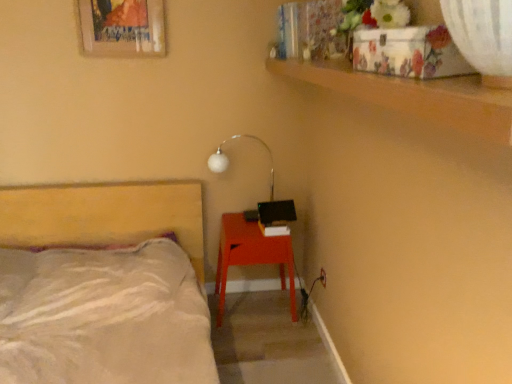
What is the approximate height of wooden picture frame at upper left?

wooden picture frame at upper left is 11.02 inches in height.

Describe the element at coordinates (104, 286) in the screenshot. Image resolution: width=512 pixels, height=384 pixels. I see `beige fabric bed at left` at that location.

Locate an element on the screen. This screenshot has height=384, width=512. wooden picture frame at upper left is located at coordinates (122, 28).

Can you confirm if beige fabric bed at left is positioned to the right of white glossy lamp at upper center?

No, beige fabric bed at left is not to the right of white glossy lamp at upper center.

Based on the photo, which object is wider, beige fabric bed at left or white glossy lamp at upper center?

beige fabric bed at left.

Is beige fabric bed at left shorter than white glossy lamp at upper center?

No, beige fabric bed at left is not shorter than white glossy lamp at upper center.

Is beige fabric bed at left turned away from white glossy lamp at upper center?

No, beige fabric bed at left is not facing the opposite direction of white glossy lamp at upper center.

From the image's perspective, which is below, wooden picture frame at upper left or white glossy lamp at upper center?

white glossy lamp at upper center, from the image's perspective.

Is wooden picture frame at upper left far from white glossy lamp at upper center?

That's not correct — wooden picture frame at upper left is a little close to white glossy lamp at upper center.

Looking at this image, is wooden picture frame at upper left looking in the opposite direction of white glossy lamp at upper center?

No, white glossy lamp at upper center is not at the back of wooden picture frame at upper left.

Is point (104, 13) closer or farther from the camera than point (219, 155)?

Point (104, 13) is positioned closer to the camera compared to point (219, 155).

Is matte red nightstand at lower right smaller than white glossy lamp at upper center?

Actually, matte red nightstand at lower right might be larger than white glossy lamp at upper center.

Can you tell me how much matte red nightstand at lower right and white glossy lamp at upper center differ in facing direction?

The angle between the facing direction of matte red nightstand at lower right and the facing direction of white glossy lamp at upper center is 0.414 degrees.

Is matte red nightstand at lower right outside of white glossy lamp at upper center?

matte red nightstand at lower right is positioned outside white glossy lamp at upper center.

From the image's perspective, which is above, matte red nightstand at lower right or white glossy lamp at upper center?

white glossy lamp at upper center.

Is point (221, 146) closer to viewer compared to point (117, 56)?

No, it is not.

From the image's perspective, which object appears higher, white glossy lamp at upper center or wooden picture frame at upper left?

wooden picture frame at upper left is shown above in the image.

Could you tell me if white glossy lamp at upper center is facing wooden picture frame at upper left?

No.

Which is in front, point (158, 27) or point (146, 218)?

The point (158, 27) is in front.

Does wooden picture frame at upper left touch beige fabric bed at left?

No, wooden picture frame at upper left is not beside beige fabric bed at left.

Is wooden picture frame at upper left positioned with its back to beige fabric bed at left?

No, wooden picture frame at upper left is not facing away from beige fabric bed at left.

Is beige fabric bed at left located within wooden picture frame at upper left?

No, beige fabric bed at left is not a part of wooden picture frame at upper left.

Can we say white glossy lamp at upper center lies outside beige fabric bed at left?

Yes, white glossy lamp at upper center is outside of beige fabric bed at left.

Can you tell me how much white glossy lamp at upper center and beige fabric bed at left differ in facing direction?

The angle between the facing direction of white glossy lamp at upper center and the facing direction of beige fabric bed at left is 0.915 degrees.

Based on the photo, from the image's perspective, is white glossy lamp at upper center located above or below beige fabric bed at left?

Based on their image positions, white glossy lamp at upper center is located above beige fabric bed at left.

Looking at this image, considering the sizes of white glossy lamp at upper center and beige fabric bed at left in the image, is white glossy lamp at upper center bigger or smaller than beige fabric bed at left?

white glossy lamp at upper center is smaller than beige fabric bed at left.

Is wooden picture frame at upper left aimed at matte red nightstand at lower right?

No, wooden picture frame at upper left is not facing towards matte red nightstand at lower right.

From the image's perspective, which one is positioned lower, wooden picture frame at upper left or matte red nightstand at lower right?

matte red nightstand at lower right is shown below in the image.

Consider the image. Is wooden picture frame at upper left in front of or behind matte red nightstand at lower right in the image?

Visually, wooden picture frame at upper left is located in front of matte red nightstand at lower right.

I want to click on picture frame above the matte red nightstand at lower right (from the image's perspective), so click(x=122, y=28).

The height and width of the screenshot is (384, 512). In the image, there is a white glossy lamp at upper center. In order to click on bed below it (from a real-world perspective) in this screenshot , I will do `click(104, 286)`.

Locate an element on the screen. The height and width of the screenshot is (384, 512). picture frame in front of the white glossy lamp at upper center is located at coordinates (122, 28).

Estimate the real-world distances between objects in this image. Which object is closer to beige fabric bed at left, matte red nightstand at lower right or white glossy lamp at upper center?

matte red nightstand at lower right.

Based on the photo, looking at the image, which one is located further to beige fabric bed at left, white glossy lamp at upper center or wooden picture frame at upper left?

Among the two, wooden picture frame at upper left is located further to beige fabric bed at left.

Considering their positions, is matte red nightstand at lower right positioned closer to beige fabric bed at left than wooden picture frame at upper left?

Among the two, matte red nightstand at lower right is located nearer to beige fabric bed at left.

Considering their positions, is wooden picture frame at upper left positioned closer to white glossy lamp at upper center than beige fabric bed at left?

The object closer to white glossy lamp at upper center is wooden picture frame at upper left.

Looking at the image, which one is located further to white glossy lamp at upper center, matte red nightstand at lower right or beige fabric bed at left?

beige fabric bed at left.

Based on their spatial positions, is white glossy lamp at upper center or matte red nightstand at lower right closer to beige fabric bed at left?

matte red nightstand at lower right lies closer to beige fabric bed at left than the other object.

Looking at the image, which one is located further to matte red nightstand at lower right, beige fabric bed at left or white glossy lamp at upper center?

beige fabric bed at left lies further to matte red nightstand at lower right than the other object.

Based on their spatial positions, is white glossy lamp at upper center or beige fabric bed at left further from matte red nightstand at lower right?

beige fabric bed at left is positioned further to the anchor matte red nightstand at lower right.

Locate an element on the screen. Image resolution: width=512 pixels, height=384 pixels. lamp between wooden picture frame at upper left and matte red nightstand at lower right vertically is located at coordinates (229, 161).

The image size is (512, 384). Find the location of `nightstand between wooden picture frame at upper left and beige fabric bed at left vertically`. nightstand between wooden picture frame at upper left and beige fabric bed at left vertically is located at coordinates (251, 256).

Where is `nightstand between beige fabric bed at left and white glossy lamp at upper center in the front-back direction`? Image resolution: width=512 pixels, height=384 pixels. nightstand between beige fabric bed at left and white glossy lamp at upper center in the front-back direction is located at coordinates click(251, 256).

Image resolution: width=512 pixels, height=384 pixels. What are the coordinates of `picture frame positioned between beige fabric bed at left and white glossy lamp at upper center from near to far` in the screenshot? It's located at (122, 28).